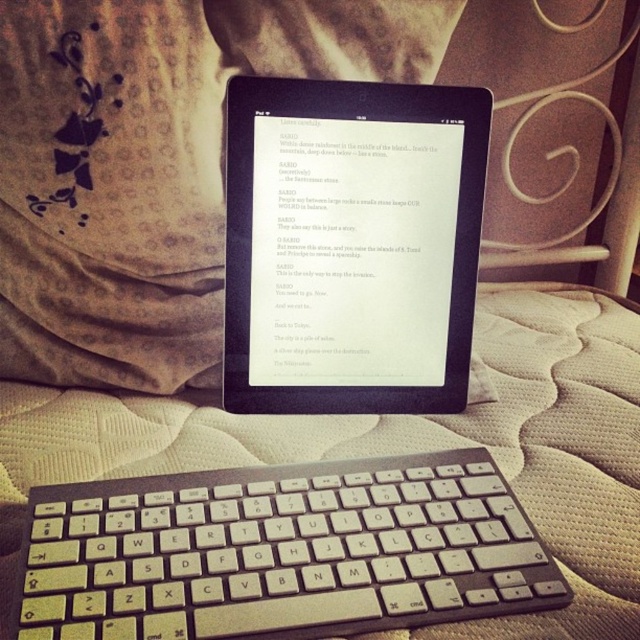
Question: Can you confirm if white plastic keyboard at center is wider than black matte tablet at center?

Choices:
 (A) yes
 (B) no

Answer: (A)

Question: Can you confirm if white plastic keyboard at center is positioned above black matte tablet at center?

Choices:
 (A) yes
 (B) no

Answer: (B)

Question: Among these points, which one is farthest from the camera?

Choices:
 (A) (429, 147)
 (B) (64, 529)

Answer: (A)

Question: Is white plastic keyboard at center above black matte tablet at center?

Choices:
 (A) yes
 (B) no

Answer: (B)